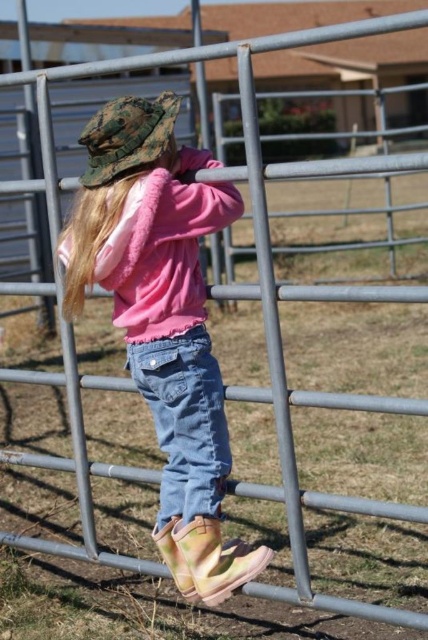
Does point (180, 384) come closer to viewer compared to point (115, 148)?

No.

Between denim jeans at center and camouflage fabric hat at upper left, which one is positioned lower?

Positioned lower is denim jeans at center.

Does point (223, 467) come in front of point (95, 120)?

No, it is behind (95, 120).

Identify the location of denim jeans at center. The height and width of the screenshot is (640, 428). (184, 420).

Between pink fleece jacket at center and denim jeans at center, which one appears on the left side from the viewer's perspective?

Positioned to the left is pink fleece jacket at center.

Does point (181, 369) come in front of point (208, 429)?

Yes, point (181, 369) is in front of point (208, 429).

Who is more forward, (x=85, y=179) or (x=181, y=397)?

Point (x=181, y=397) is in front.

Find the location of a particular element. The width and height of the screenshot is (428, 640). pink fleece jacket at center is located at coordinates (162, 317).

In the scene shown: Does pink fleece jacket at center have a larger size compared to camouflage fabric hat at upper left?

Yes, pink fleece jacket at center is bigger than camouflage fabric hat at upper left.

Can you confirm if pink fleece jacket at center is wider than camouflage fabric hat at upper left?

Yes, pink fleece jacket at center is wider than camouflage fabric hat at upper left.

Measure the distance between point (202, 456) and camera.

Point (202, 456) and camera are 9.67 feet apart from each other.

Locate an element on the screen. Image resolution: width=428 pixels, height=640 pixels. pink fleece jacket at center is located at coordinates (162, 317).